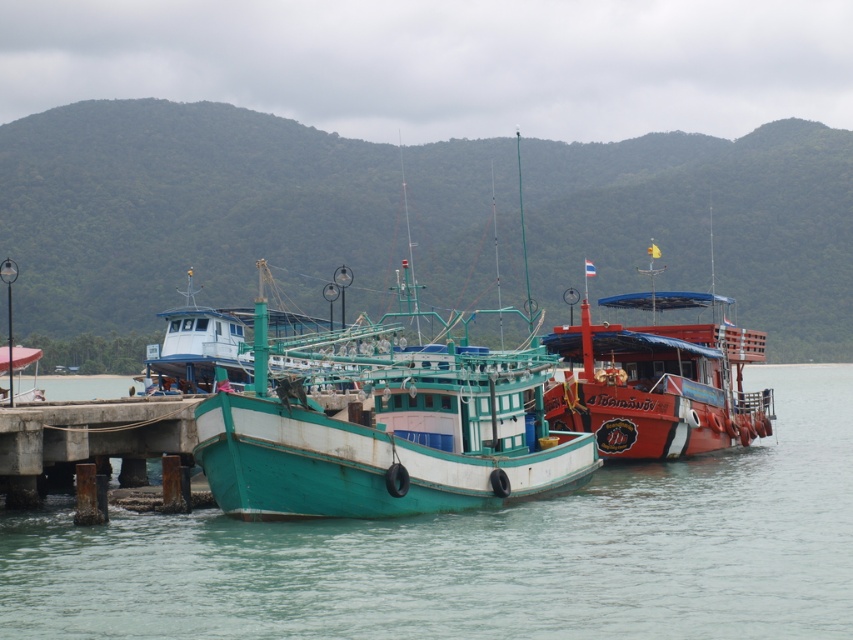
You are standing on the concrete pier at lower left and want to reach the green matte water at center. Which direction should you move to get there?

The green matte water at center is in front of the concrete pier at lower left, so you should move forward from the concrete pier at lower left toward the green matte water at center to reach it.

You are a dock attendant who needs to allocate space for two boats. The teal wooden boat at center and the shiny red boat at right are both docked. Which boat requires more space due to its size?

The teal wooden boat at center requires more space because it has a larger size compared to the shiny red boat at right.